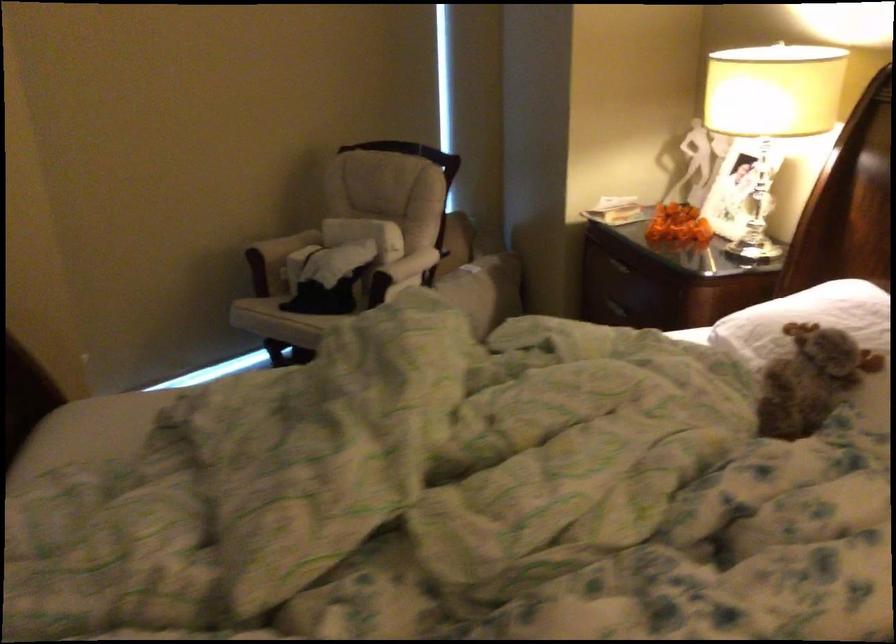
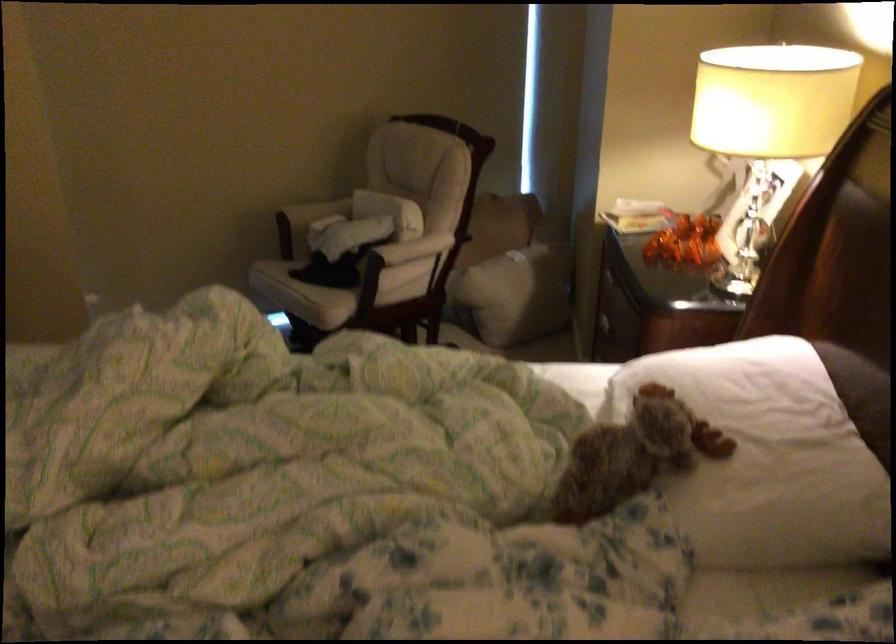
Question: Which direction would the cameraman need to move to produce the second image? Reply with the corresponding letter.

Choices:
 (A) Left
 (B) Right
 (C) Forward
 (D) Backward

Answer: (B)